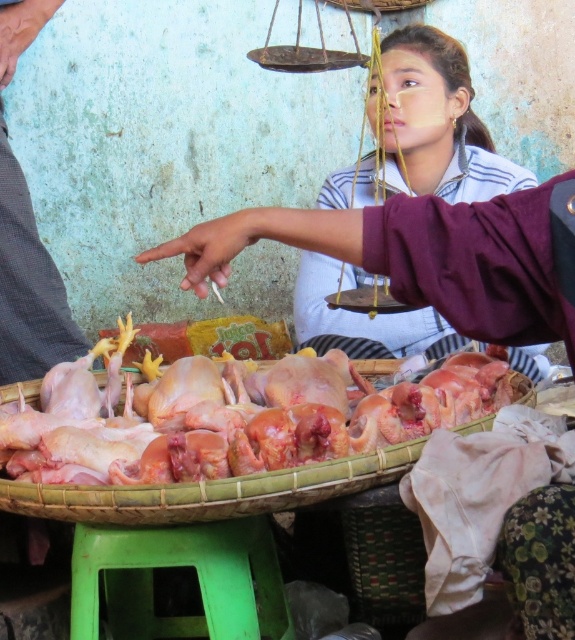
You are a customer at the market and want to ask the vendor about the price of the chickens. The vendor is wearing a blue striped shirt at center. Where should you look to see the metallic scale at upper center that might indicate the price?

The metallic scale at upper center is above the blue striped shirt at center, so you should look above the vendor wearing the blue striped shirt at center to see the metallic scale at upper center.